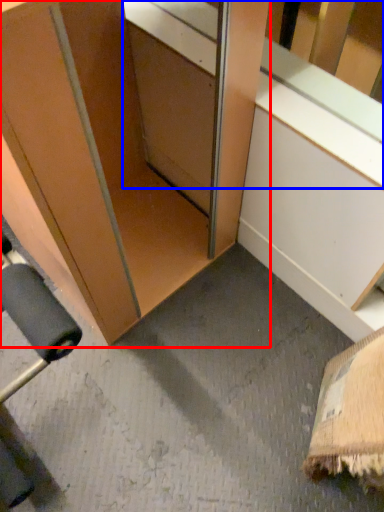
Question: Which object is closer to the camera taking this photo, cabinetry (highlighted by a red box) or window sill (highlighted by a blue box)?

Choices:
 (A) cabinetry
 (B) window sill

Answer: (A)